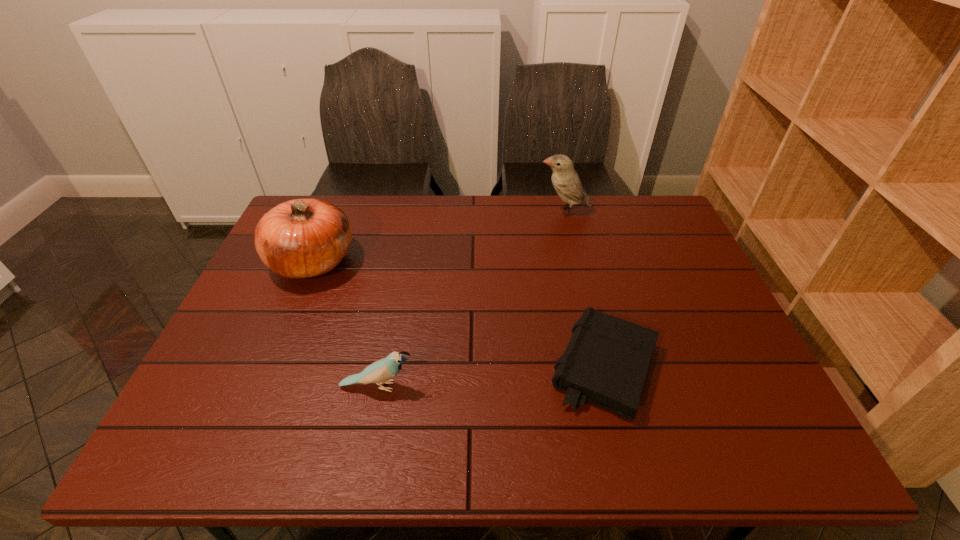
What are the coordinates of `free space at the left edge` in the screenshot? It's located at (310, 285).

You are a GUI agent. You are given a task and a screenshot of the screen. Output one action in this format:
    pyautogui.click(x=<x>, y=<y>)
    Task: Click on the vacant space at the right edge of the desktop
    Image resolution: width=960 pixels, height=540 pixels.
    Given the screenshot: What is the action you would take?
    pyautogui.click(x=646, y=259)

This screenshot has height=540, width=960. In the image, there is a desktop. Identify the location of vacant space at the far right corner. (649, 220).

Identify the location of unoccupied area between the nearer bird and the pumpkin. The image size is (960, 540). (346, 324).

This screenshot has height=540, width=960. What are the coordinates of `unoccupied area between the second farthest object and the taller bird` in the screenshot? It's located at (439, 237).

This screenshot has width=960, height=540. I want to click on blank region between the third tallest object and the Bible, so click(x=491, y=377).

Locate an element on the screen. vacant area that lies between the farther bird and the Bible is located at coordinates click(x=584, y=289).

Locate an element on the screen. Image resolution: width=960 pixels, height=540 pixels. blank region between the pumpkin and the shorter bird is located at coordinates (346, 324).

Where is `vacant point located between the shortest object and the pumpkin`? Image resolution: width=960 pixels, height=540 pixels. vacant point located between the shortest object and the pumpkin is located at coordinates (458, 314).

I want to click on empty location between the shortest object and the nearer bird, so click(491, 377).